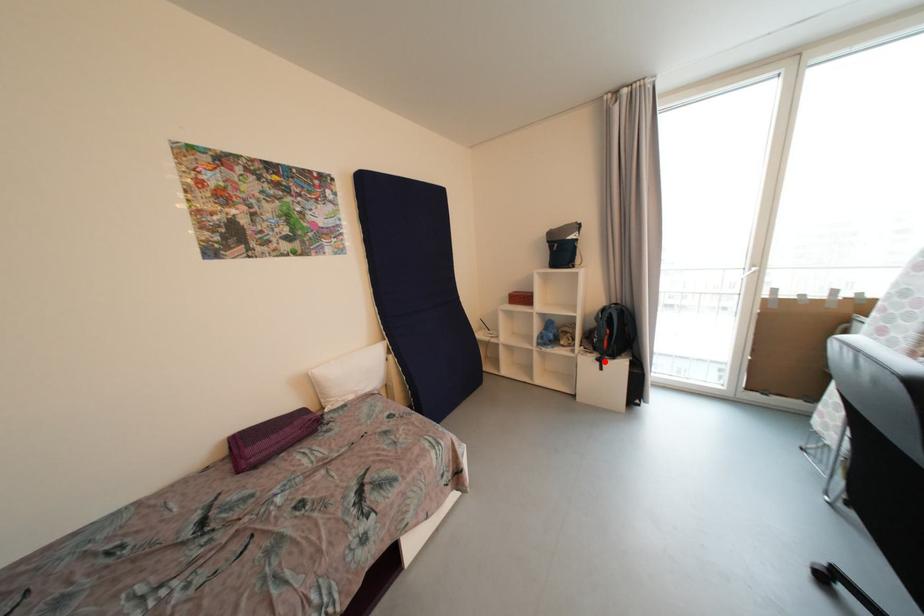
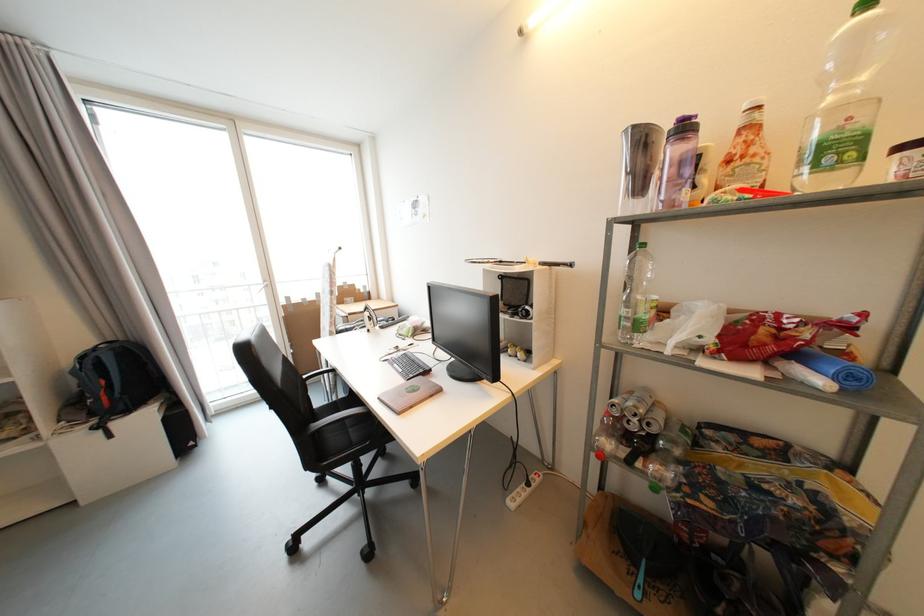
Question: I am providing you with two images of the same scene from different viewpoints. A red point is marked on the first image. Can you still see the location of the red point in image 2?

Choices:
 (A) Yes
 (B) No

Answer: (A)